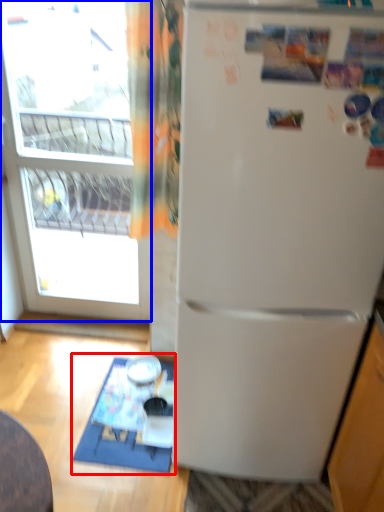
Question: Which of the following is the closest to the observer, table (highlighted by a red box) or window (highlighted by a blue box)?

Choices:
 (A) table
 (B) window

Answer: (B)